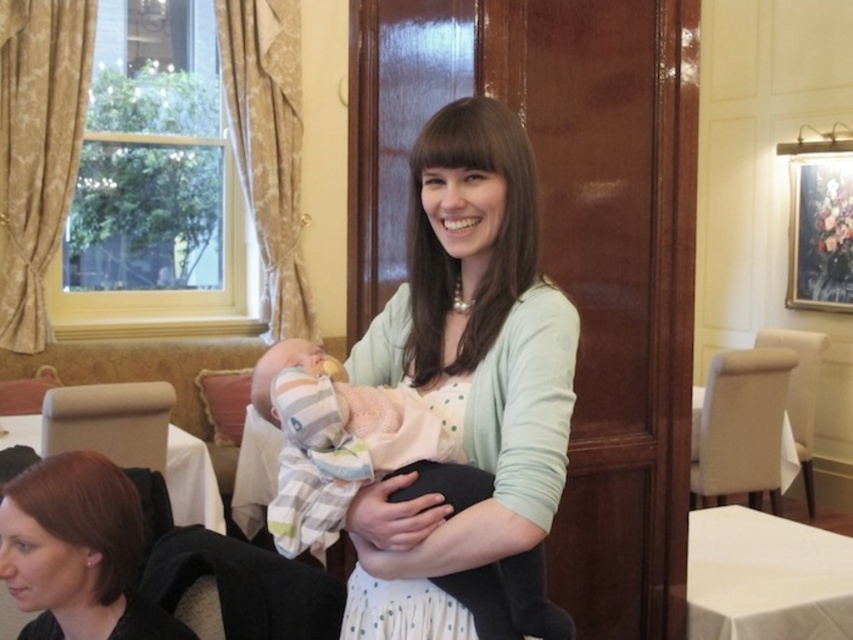
Question: Is smooth black hair at lower left to the right of striped cotton blanket at center from the viewer's perspective?

Choices:
 (A) no
 (B) yes

Answer: (A)

Question: Which is nearer to the striped cotton blanket at center?

Choices:
 (A) smooth black hair at lower left
 (B) white cloth at lower right

Answer: (A)

Question: Based on their relative distances, which object is farther from the white cloth at lower right?

Choices:
 (A) light green cardigan at center
 (B) smooth black hair at lower left
 (C) striped cotton blanket at center

Answer: (B)

Question: Considering the real-world distances, which object is closest to the light green cardigan at center?

Choices:
 (A) smooth black hair at lower left
 (B) white cloth at lower right

Answer: (A)

Question: Can you confirm if smooth black hair at lower left is wider than striped cotton blanket at center?

Choices:
 (A) yes
 (B) no

Answer: (A)

Question: Does smooth black hair at lower left lie behind white cloth at lower right?

Choices:
 (A) no
 (B) yes

Answer: (A)